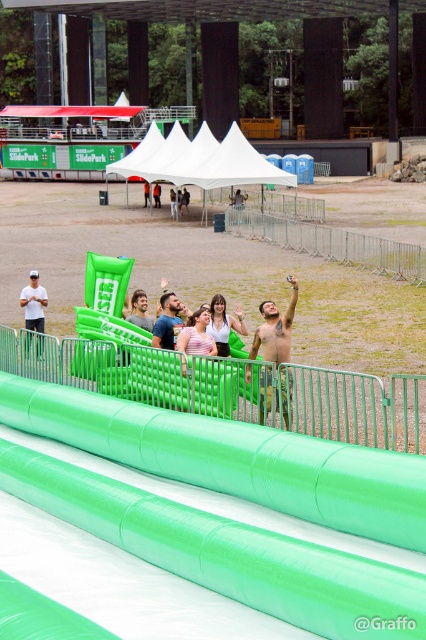
Question: Which point is closer to the camera taking this photo?

Choices:
 (A) pos(150,452)
 (B) pos(271,340)

Answer: (A)

Question: Does green plastic rail at center have a lesser width compared to matte green inflatable at center?

Choices:
 (A) yes
 (B) no

Answer: (B)

Question: Which point appears closest to the camera in this image?

Choices:
 (A) (230, 212)
 (B) (187, 348)
 (C) (32, 314)

Answer: (B)

Question: Does shiny metallic tank top at upper right appear over striped fabric shirt at center?

Choices:
 (A) yes
 (B) no

Answer: (A)

Question: In this image, where is shiny metallic tank top at upper right located relative to smooth blue shirt at center?

Choices:
 (A) left
 (B) right

Answer: (B)

Question: Which point is closer to the camera?

Choices:
 (A) (255, 355)
 (B) (218, 298)
 (C) (229, 221)
 (D) (43, 419)

Answer: (D)